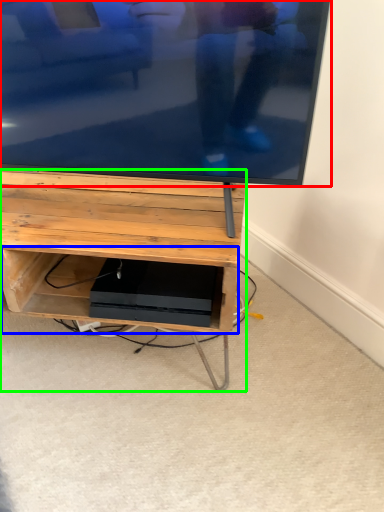
Question: Estimate the real-world distances between objects in this image. Which object is closer to television (highlighted by a red box), shelf (highlighted by a blue box) or furniture (highlighted by a green box)?

Choices:
 (A) shelf
 (B) furniture

Answer: (B)